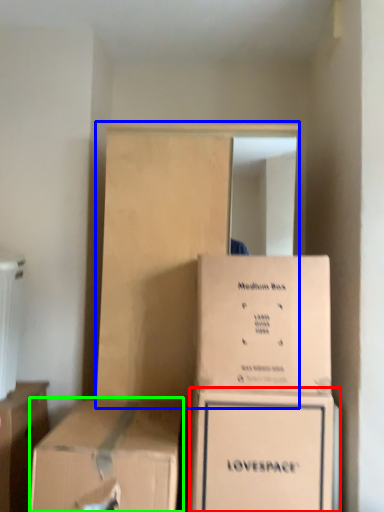
Question: Based on their relative distances, which object is farther from box (highlighted by a red box)? Choose from dresser (highlighted by a blue box) and box (highlighted by a green box).

Choices:
 (A) dresser
 (B) box

Answer: (A)